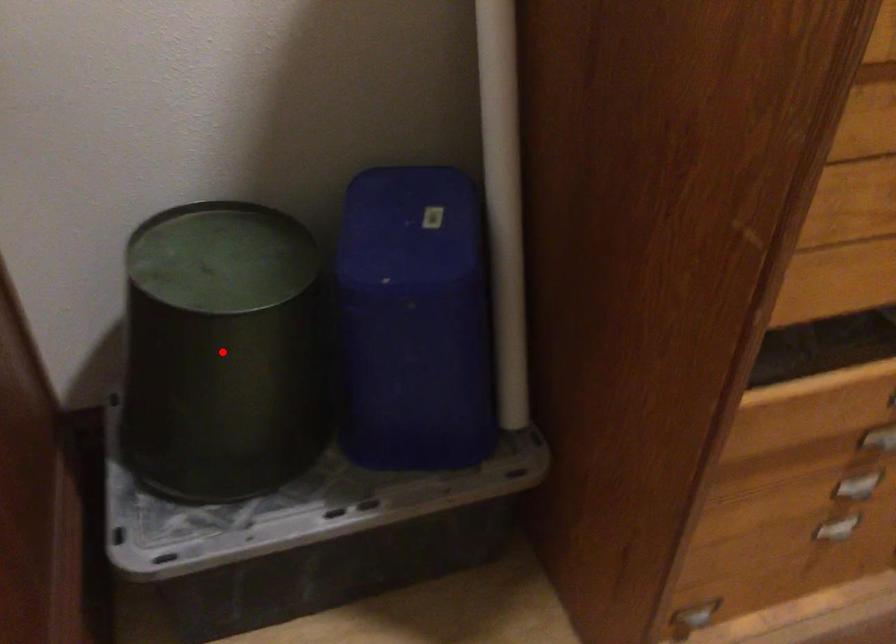
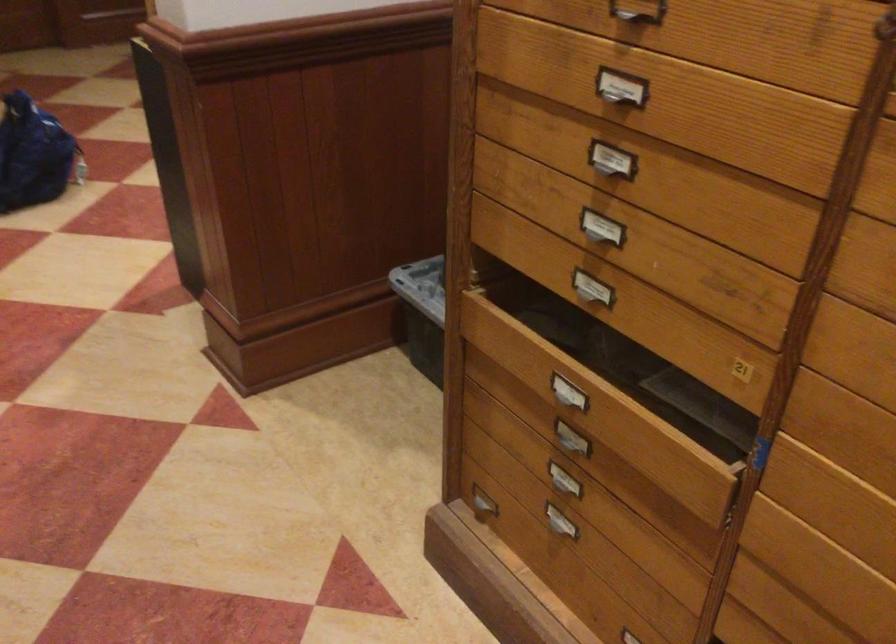
Question: I am providing you with two images of the same scene from different viewpoints. A red point is marked on the first image. At the location where the point appears in image 1, is it still visible in image 2?

Choices:
 (A) Yes
 (B) No

Answer: (B)